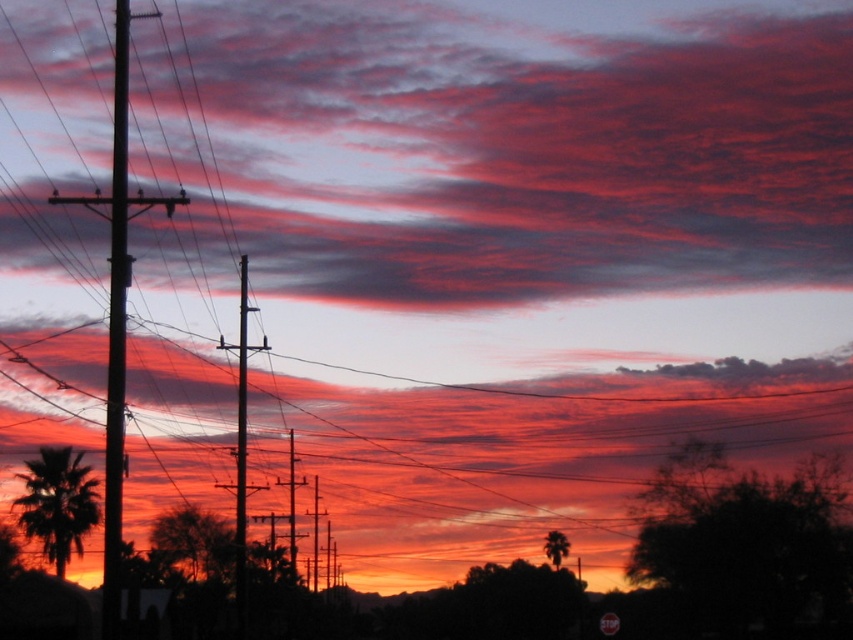
Question: Considering the relative positions of matte red cloud at upper center and metallic red stop sign at lower right in the image provided, where is matte red cloud at upper center located with respect to metallic red stop sign at lower right?

Choices:
 (A) below
 (B) above

Answer: (B)

Question: Among these objects, which one is nearest to the camera?

Choices:
 (A) metallic red stop sign at lower right
 (B) matte red cloud at upper center
 (C) smooth wood telegraph pole at center

Answer: (B)

Question: Which point is farther to the camera?

Choices:
 (A) smooth wood telegraph pole at center
 (B) smooth wood telegraph pole at left
 (C) metallic red stop sign at lower right
 (D) matte red cloud at upper center

Answer: (C)

Question: Where is smooth wood telegraph pole at center located in relation to metallic red stop sign at lower right in the image?

Choices:
 (A) above
 (B) below

Answer: (A)

Question: Is matte red cloud at upper center positioned before metallic red stop sign at lower right?

Choices:
 (A) no
 (B) yes

Answer: (B)

Question: Based on their relative distances, which object is nearer to the metallic red stop sign at lower right?

Choices:
 (A) smooth wood telegraph pole at center
 (B) matte red cloud at upper center

Answer: (A)